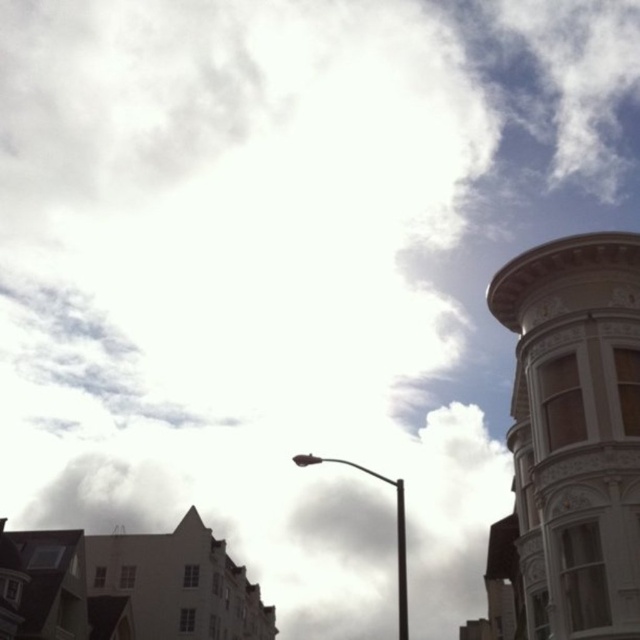
Question: Among these points, which one is nearest to the camera?

Choices:
 (A) (403, 586)
 (B) (314, 461)

Answer: (B)

Question: Is metallic pole at center positioned before black metal pole at center?

Choices:
 (A) yes
 (B) no

Answer: (A)

Question: Is metallic pole at center thinner than black metal pole at center?

Choices:
 (A) no
 (B) yes

Answer: (A)

Question: Does metallic pole at center appear over black metal pole at center?

Choices:
 (A) no
 (B) yes

Answer: (B)

Question: Which object is farther from the camera taking this photo?

Choices:
 (A) metallic pole at center
 (B) black metal pole at center

Answer: (B)